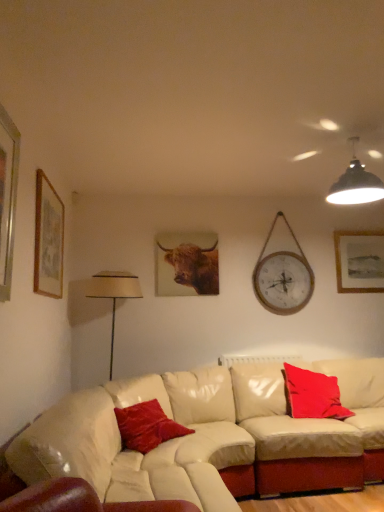
Question: Does black matte pendant light at upper right have a greater width compared to wooden/textured clock at upper right?

Choices:
 (A) yes
 (B) no

Answer: (A)

Question: Is black matte pendant light at upper right looking in the opposite direction of wooden/textured clock at upper right?

Choices:
 (A) no
 (B) yes

Answer: (B)

Question: Does black matte pendant light at upper right have a larger size compared to wooden/textured clock at upper right?

Choices:
 (A) yes
 (B) no

Answer: (A)

Question: Does black matte pendant light at upper right have a lesser width compared to wooden/textured clock at upper right?

Choices:
 (A) yes
 (B) no

Answer: (B)

Question: Is black matte pendant light at upper right located outside wooden/textured clock at upper right?

Choices:
 (A) yes
 (B) no

Answer: (A)

Question: Could you tell me if black matte pendant light at upper right is facing wooden/textured clock at upper right?

Choices:
 (A) no
 (B) yes

Answer: (A)

Question: Is beige fabric lampshade at left next to silver metallic picture frame at left, positioned as the 3th picture frame in back-to-front order, and touching it?

Choices:
 (A) yes
 (B) no

Answer: (B)

Question: From the image's perspective, is beige fabric lampshade at left on top of silver metallic picture frame at left, which is the 1th picture frame from front to back?

Choices:
 (A) no
 (B) yes

Answer: (A)

Question: From a real-world perspective, is beige fabric lampshade at left beneath silver metallic picture frame at left, positioned as the 3th picture frame in back-to-front order?

Choices:
 (A) yes
 (B) no

Answer: (A)

Question: Considering the relative sizes of beige fabric lampshade at left and silver metallic picture frame at left, placed as the second picture frame when sorted from left to right, in the image provided, is beige fabric lampshade at left thinner than silver metallic picture frame at left, placed as the second picture frame when sorted from left to right,?

Choices:
 (A) no
 (B) yes

Answer: (A)

Question: From the image's perspective, is beige fabric lampshade at left below silver metallic picture frame at left, which is the 1th picture frame from front to back?

Choices:
 (A) yes
 (B) no

Answer: (A)

Question: Does beige fabric lampshade at left have a greater width compared to silver metallic picture frame at left, placed as the second picture frame when sorted from left to right?

Choices:
 (A) yes
 (B) no

Answer: (A)

Question: From the image's perspective, is velvet red pillow at center, the first pillow when ordered from front to back, above wooden framed artwork at upper right, the first picture frame positioned from the right?

Choices:
 (A) no
 (B) yes

Answer: (A)